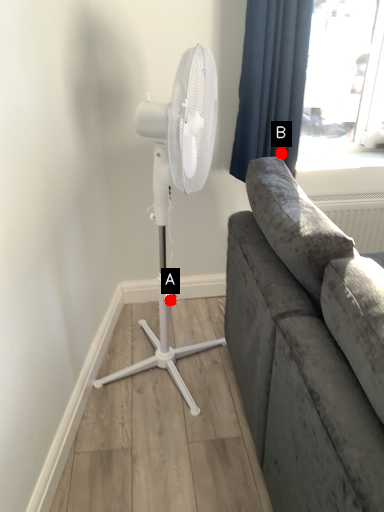
Question: Two points are circled on the image, labeled by A and B beside each circle. Which of the following is the closest to the observer?

Choices:
 (A) A is closer
 (B) B is closer

Answer: (A)